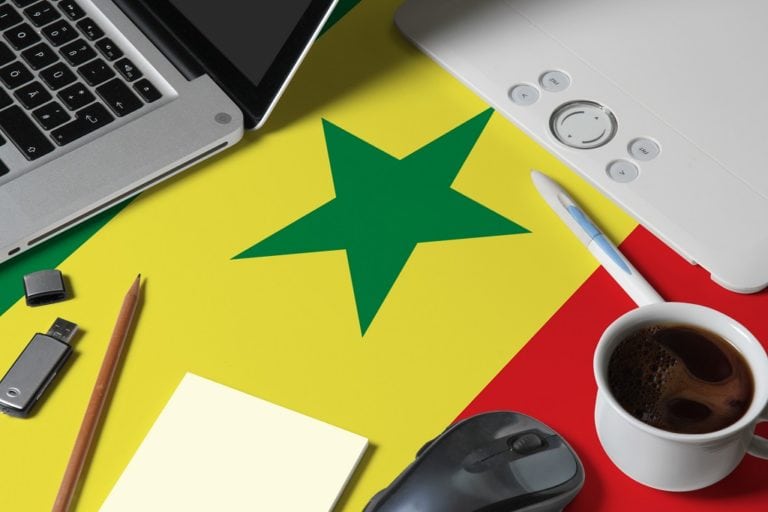
The image size is (768, 512). Identify the location of mouse. (508, 464).